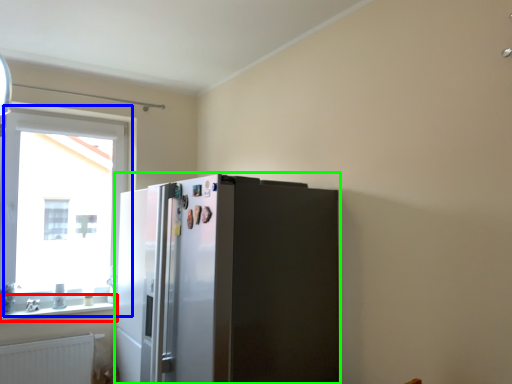
Question: Based on their relative distances, which object is farther from window sill (highlighted by a red box)? Choose from window (highlighted by a blue box) and refrigerator (highlighted by a green box).

Choices:
 (A) window
 (B) refrigerator

Answer: (B)